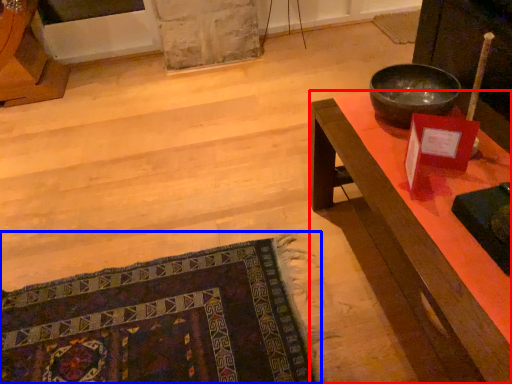
Question: Among these objects, which one is farthest to the camera, desk (highlighted by a red box) or mat (highlighted by a blue box)?

Choices:
 (A) desk
 (B) mat

Answer: (B)